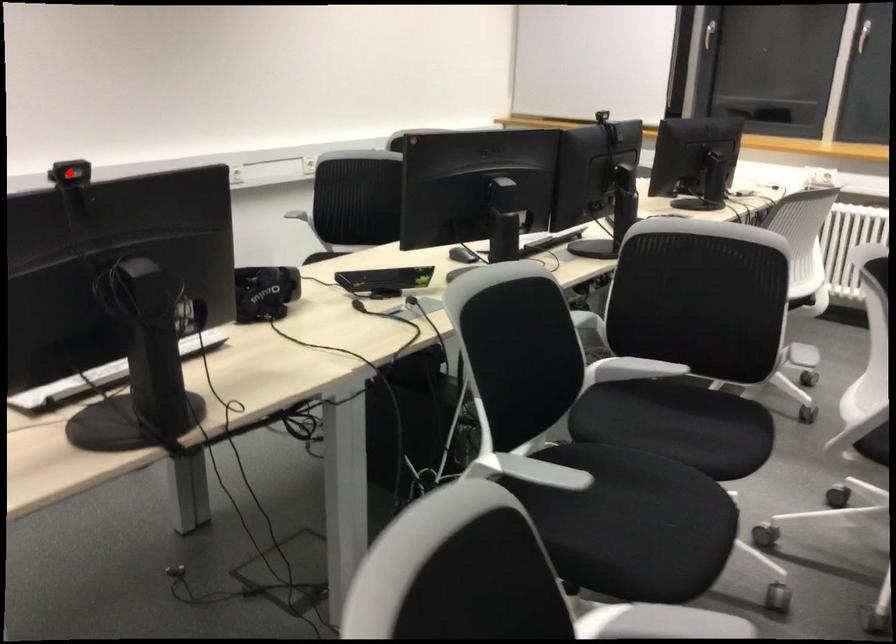
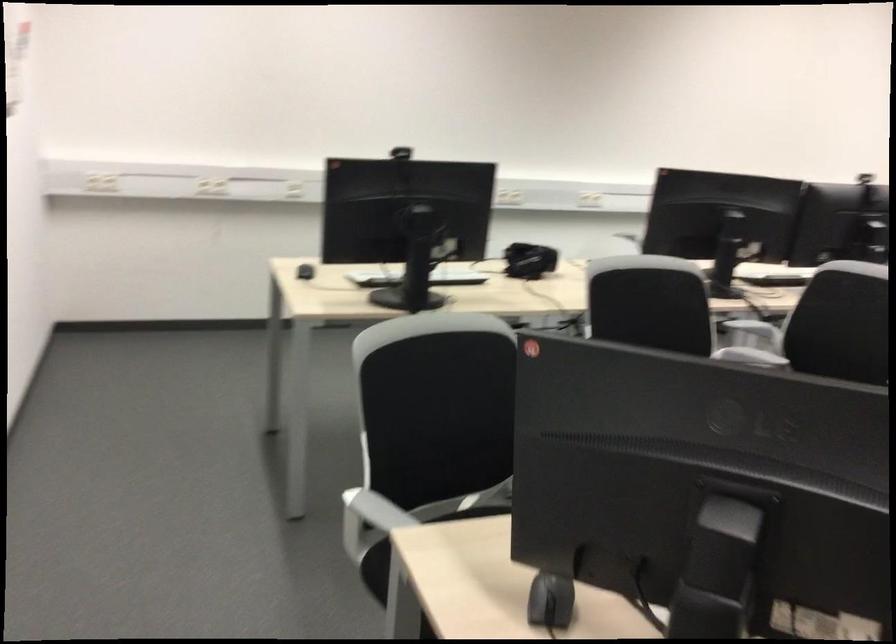
Question: I am providing you with two images of the same scene from different viewpoints. A red point is marked on the first image. Can you still see the location of the red point in image 2?

Choices:
 (A) Yes
 (B) No

Answer: (B)